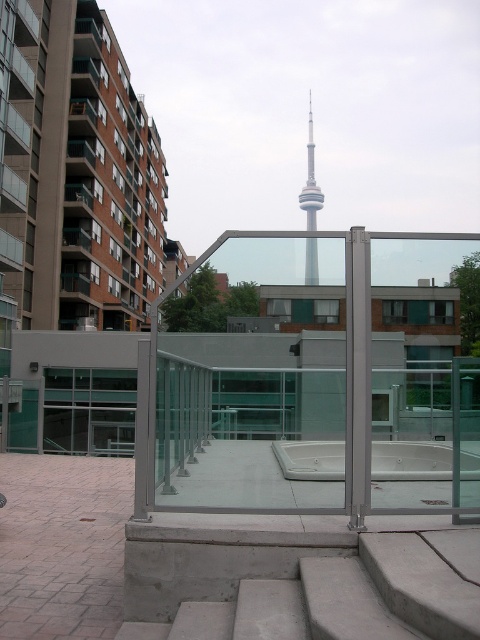
Question: Can you confirm if concrete stairs at lower center is positioned to the right of silver metallic tower at center?

Choices:
 (A) no
 (B) yes

Answer: (A)

Question: Which of the following is the farthest from the observer?

Choices:
 (A) (308, 225)
 (B) (459, 458)
 (C) (470, 630)
 (D) (230, 264)

Answer: (A)

Question: Is white glossy pool at center positioned behind silver metallic tower at center?

Choices:
 (A) yes
 (B) no

Answer: (A)

Question: Which of these objects is positioned closest to the white glossy pool at center?

Choices:
 (A) concrete stairs at lower center
 (B) silver metallic tower at center

Answer: (A)

Question: Which point is farther from the camera taking this photo?

Choices:
 (A) (456, 486)
 (B) (314, 180)
 (C) (126, 561)
 (D) (388, 449)

Answer: (B)

Question: Does transparent glass door at center have a larger size compared to concrete stairs at lower center?

Choices:
 (A) no
 (B) yes

Answer: (B)